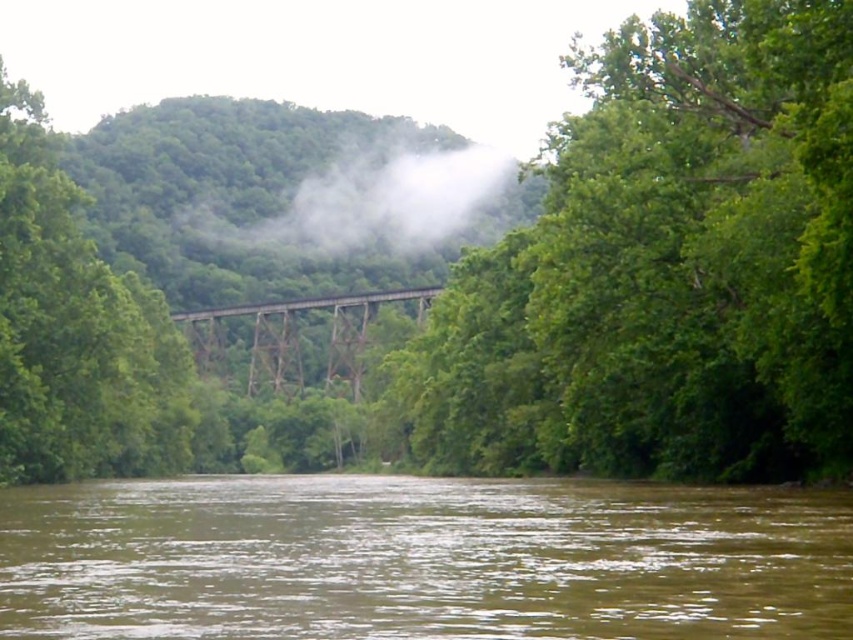
Question: Is green leafy tree at upper center wider than brown muddy water at lower center?

Choices:
 (A) yes
 (B) no

Answer: (B)

Question: Which object is closer to the camera taking this photo?

Choices:
 (A) brown muddy water at lower center
 (B) brown wooden train bridge at center
 (C) white foggy mist at center

Answer: (A)

Question: Is green leafy tree at upper center above brown muddy water at lower center?

Choices:
 (A) yes
 (B) no

Answer: (A)

Question: Which object is positioned farthest from the white foggy mist at center?

Choices:
 (A) green leafy tree at upper center
 (B) brown wooden train bridge at center

Answer: (A)

Question: Is green leafy tree at upper center bigger than white foggy mist at center?

Choices:
 (A) no
 (B) yes

Answer: (B)

Question: Which of the following is the closest to the observer?

Choices:
 (A) (680, 339)
 (B) (73, 541)
 (C) (405, 193)
 (D) (350, 296)

Answer: (B)